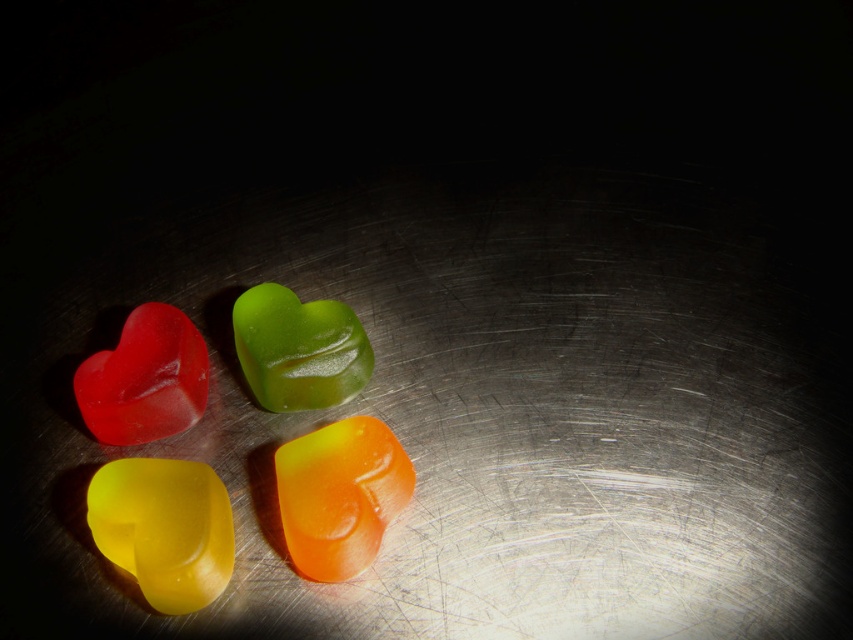
You are arranging candies on a metallic surface and see the translucent yellow heart at lower left and the translucent orange heart at center. Which candy is positioned lower on the surface?

The translucent yellow heart at lower left is positioned lower than the translucent orange heart at center.

Looking at the metallic surface, you see the translucent yellow heart at lower left and the matte translucent heart at upper left. Which of these two candies is positioned more to the right?

The translucent yellow heart at lower left is positioned more to the right compared to the matte translucent heart at upper left.

You are a robotic arm trying to pick up the candies. You need to move from the starting position to the first candy at point (x=189, y=536) and then to the second candy at point (x=96, y=436). Which candy should you pick up first to follow the correct path?

You should pick up the candy at point (x=189, y=536) first because it is in front of the candy at point (x=96, y=436), so you can reach it without obstruction.